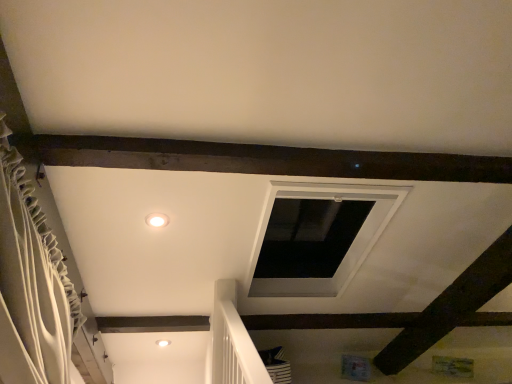
Question: Would you say matte white light fixture at center is to the left or to the right of white textured curtain at left in the picture?

Choices:
 (A) right
 (B) left

Answer: (A)

Question: From the image's perspective, relative to white textured curtain at left, is matte white light fixture at center above or below?

Choices:
 (A) above
 (B) below

Answer: (A)

Question: Considering the positions of matte white light fixture at center and white textured curtain at left in the image, is matte white light fixture at center bigger or smaller than white textured curtain at left?

Choices:
 (A) big
 (B) small

Answer: (B)

Question: Would you say white textured curtain at left is to the left or to the right of matte white light fixture at center in the picture?

Choices:
 (A) left
 (B) right

Answer: (A)

Question: Which is correct: white textured curtain at left is inside matte white light fixture at center, or outside of it?

Choices:
 (A) inside
 (B) outside

Answer: (B)

Question: Is white textured curtain at left in front of or behind matte white light fixture at center in the image?

Choices:
 (A) front
 (B) behind

Answer: (A)

Question: Is white textured curtain at left taller or shorter than matte white light fixture at center?

Choices:
 (A) short
 (B) tall

Answer: (B)